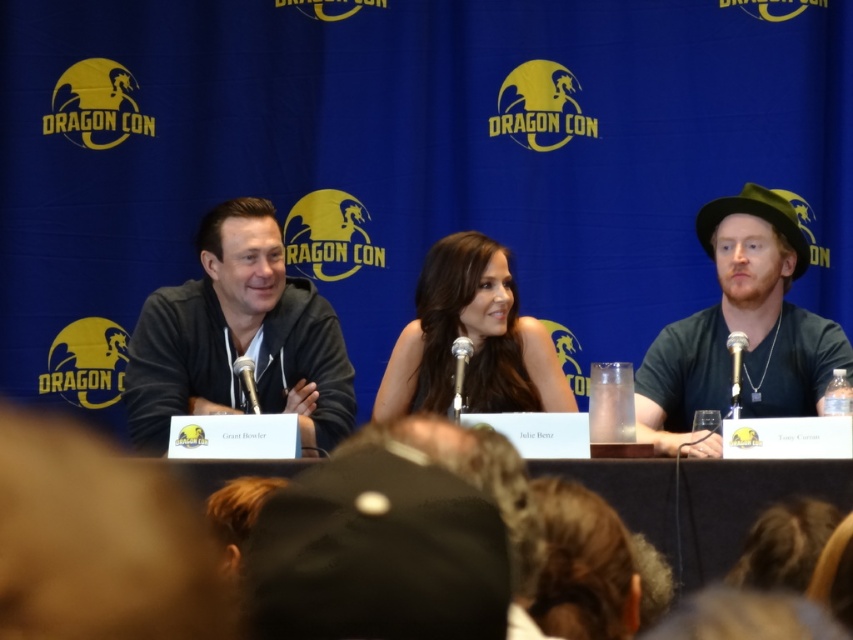
You are attending Dragon Con and notice two attendees dressed in black. One is wearing a matte black hat at right, and the other has a satin black dress at center. Based on the description provided, which item is positioned farther to the east in the image?

The matte black hat at right is positioned to the right of the satin black dress at center, so it is farther to the east in the image.

You are organizing a photo shoot for a fashion magazine and need to ensure that the matte black hat at right and the satin black dress at center are both visible in the frame. Given their sizes, which item might require more careful positioning to avoid being obscured?

The matte black hat at right is bigger than the satin black dress at center, so it might require more careful positioning to ensure it doesn not overshadow the dress.

You are attending Dragon Con and want to take a photo of the dark gray hoodie at left. The camera you have can only focus on objects within a 0.3 unit radius around the point specified. If the point given is at coordinates (239,337), will the camera focus on the dark gray hoodie at left?

The point (239,337) corresponds to the dark gray hoodie at left, so yes, the camera will focus on the dark gray hoodie at left as it is exactly at the specified coordinates.